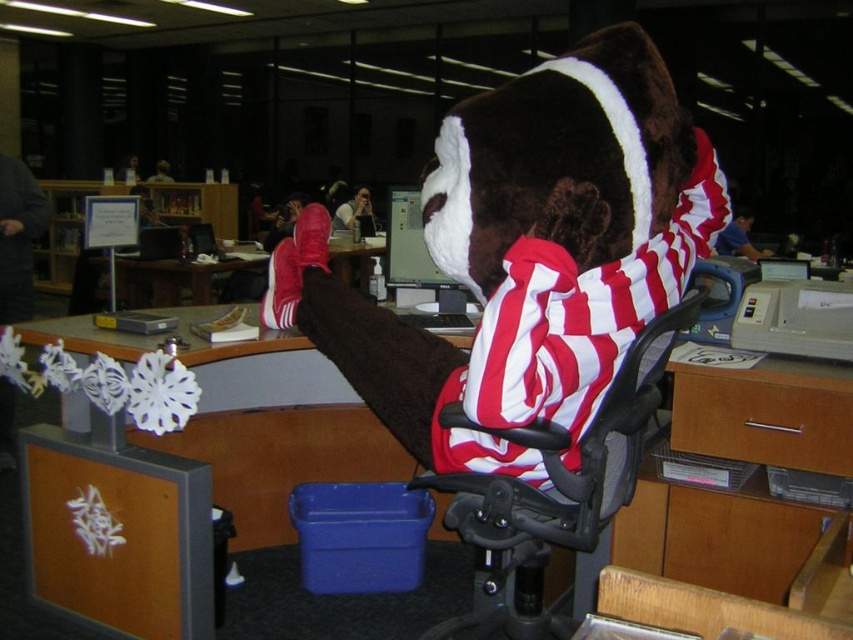
Question: Estimate the real-world distances between objects in this image. Which object is farther from the black mesh swivel chair at center?

Choices:
 (A) matte plastic desk at center
 (B) black mesh chair at center

Answer: (A)

Question: Where is black mesh chair at center located in relation to matte plastic desk at center in the image?

Choices:
 (A) below
 (B) above

Answer: (A)

Question: In this image, where is black mesh chair at center located relative to matte plastic desk at center?

Choices:
 (A) left
 (B) right

Answer: (B)

Question: Estimate the real-world distances between objects in this image. Which object is closer to the matte plastic desk at center?

Choices:
 (A) black mesh chair at center
 (B) black mesh swivel chair at center

Answer: (A)

Question: Does black mesh swivel chair at center have a lesser width compared to matte plastic desk at center?

Choices:
 (A) no
 (B) yes

Answer: (B)

Question: Which of these objects is positioned closest to the black mesh chair at center?

Choices:
 (A) black mesh swivel chair at center
 (B) matte plastic desk at center

Answer: (A)